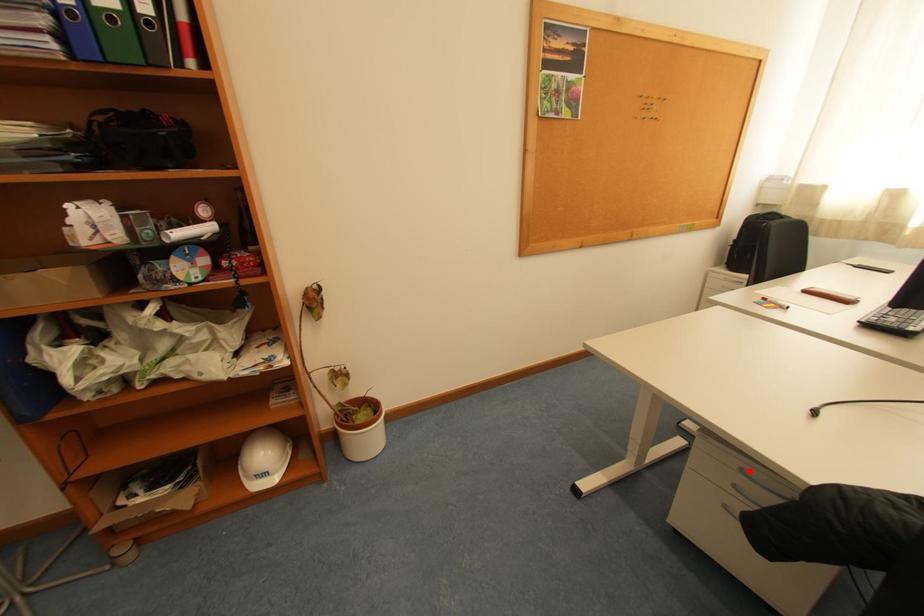
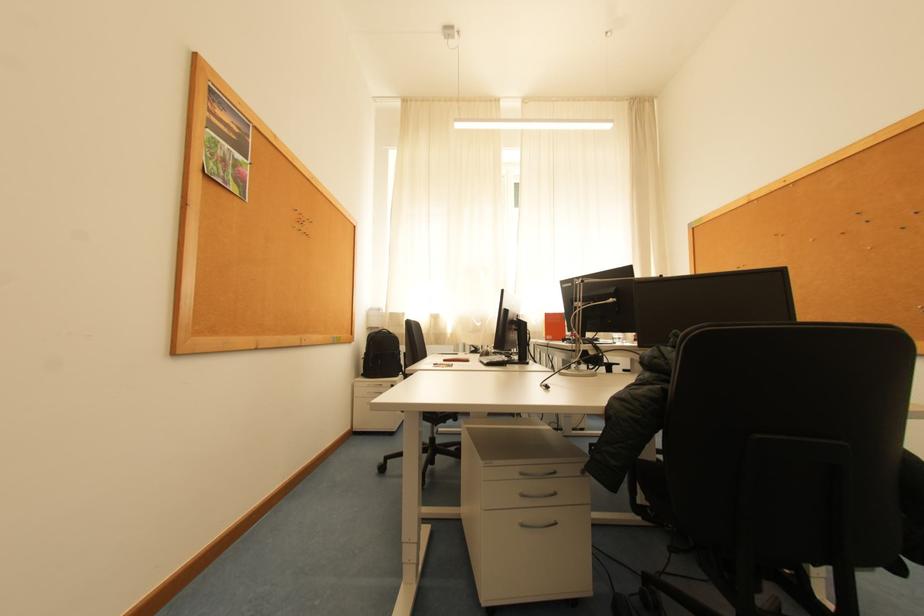
The point at the highlighted location is marked in the first image. Where is the corresponding point in the second image?

(529, 475)